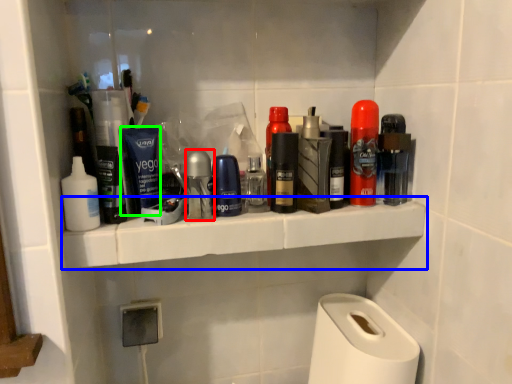
Question: Which object is positioned farthest from toiletry (highlighted by a red box)? Select from ledge (highlighted by a blue box) and personal care (highlighted by a green box).

Choices:
 (A) ledge
 (B) personal care

Answer: (A)